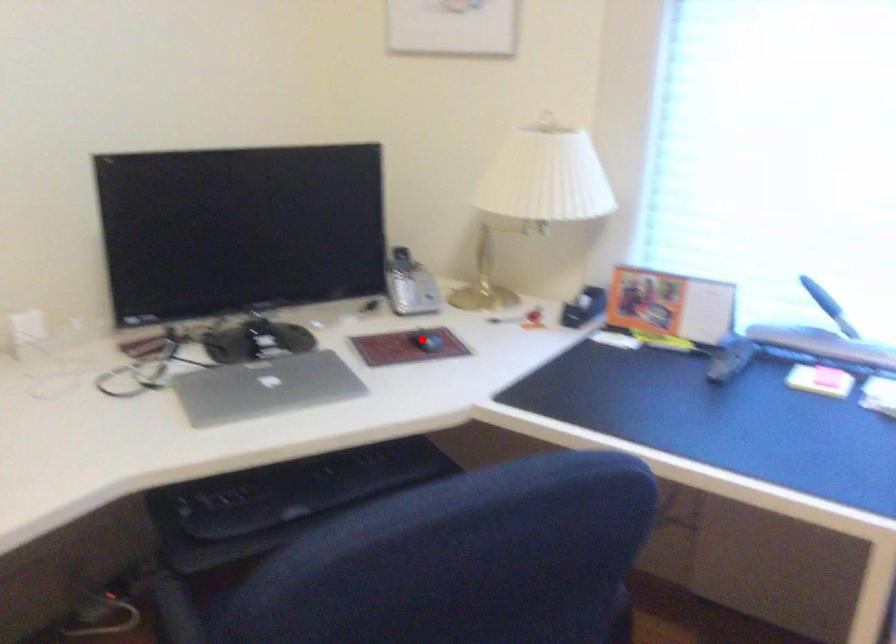
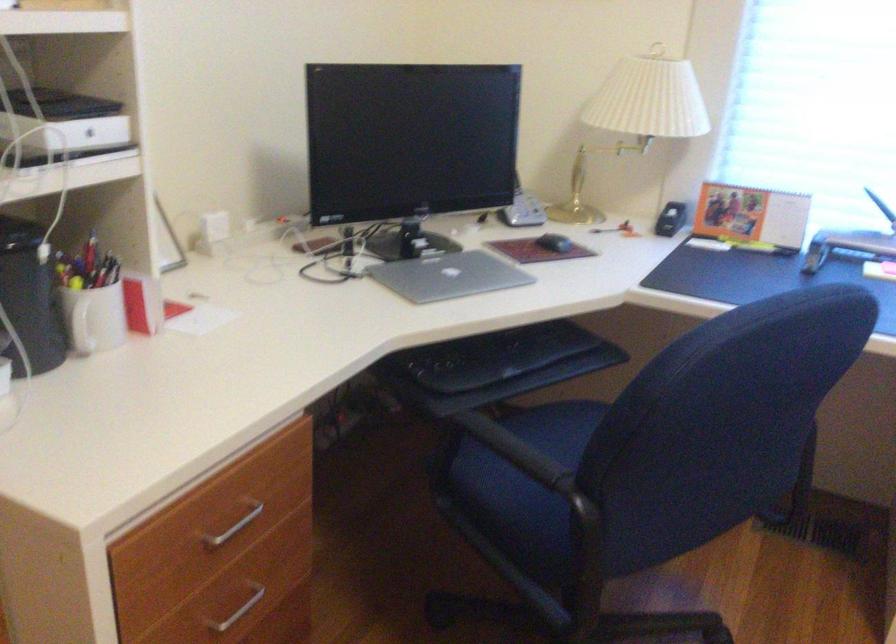
Question: I am providing you with two images of the same scene from different viewpoints. A red point is shown in image1. For the corresponding object point in image2, is it positioned nearer or farther from the camera?

Choices:
 (A) Nearer
 (B) Farther

Answer: (B)